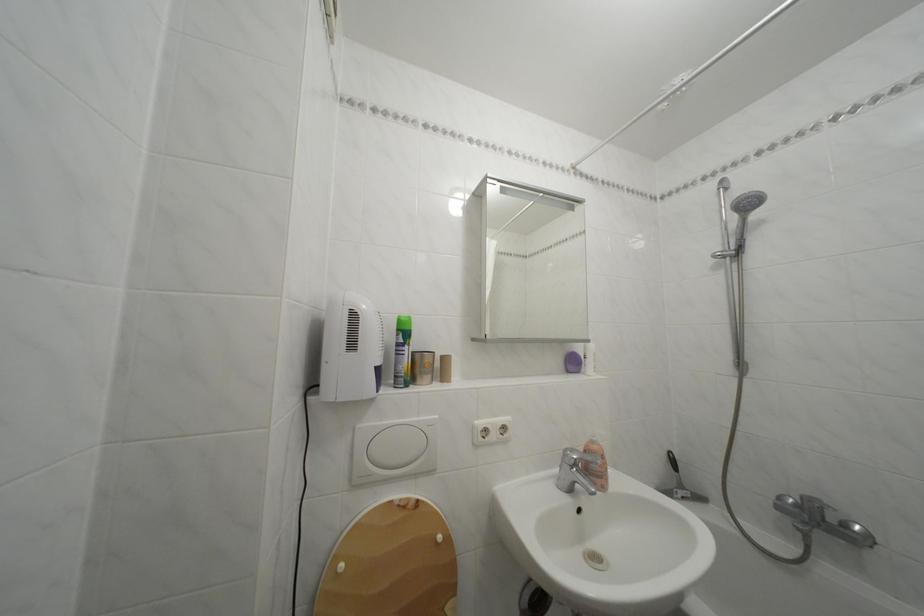
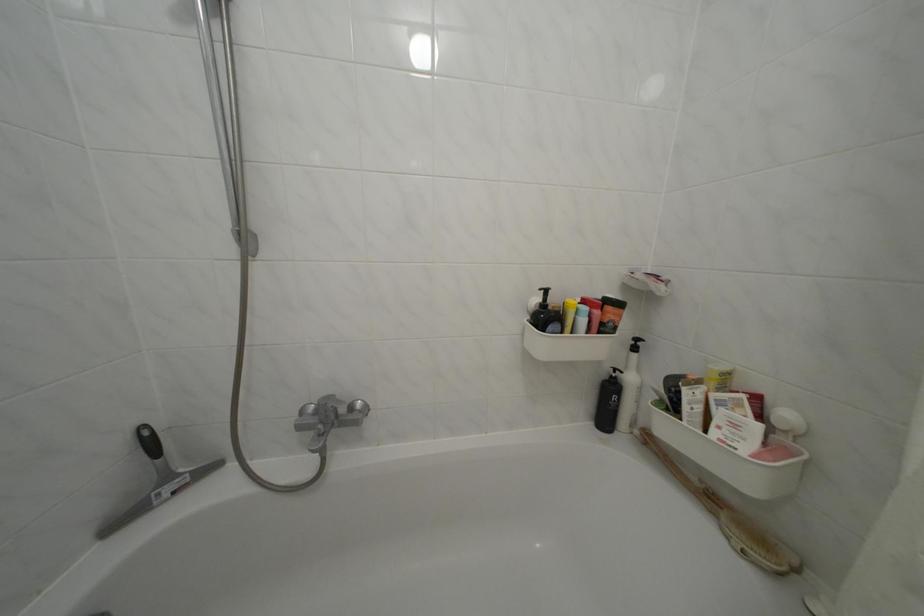
Find the pixel in the second image that matches point 854,531 in the first image.

(359, 414)